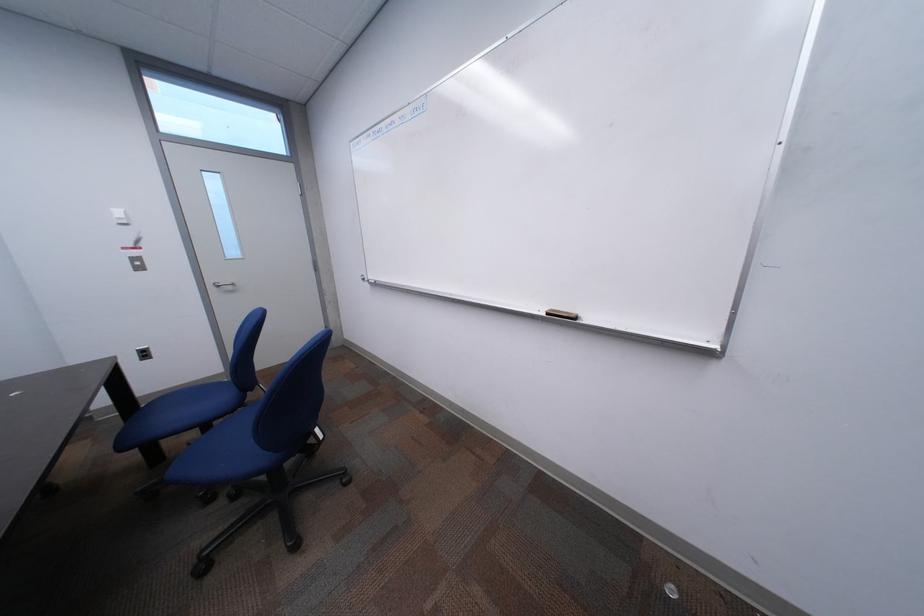
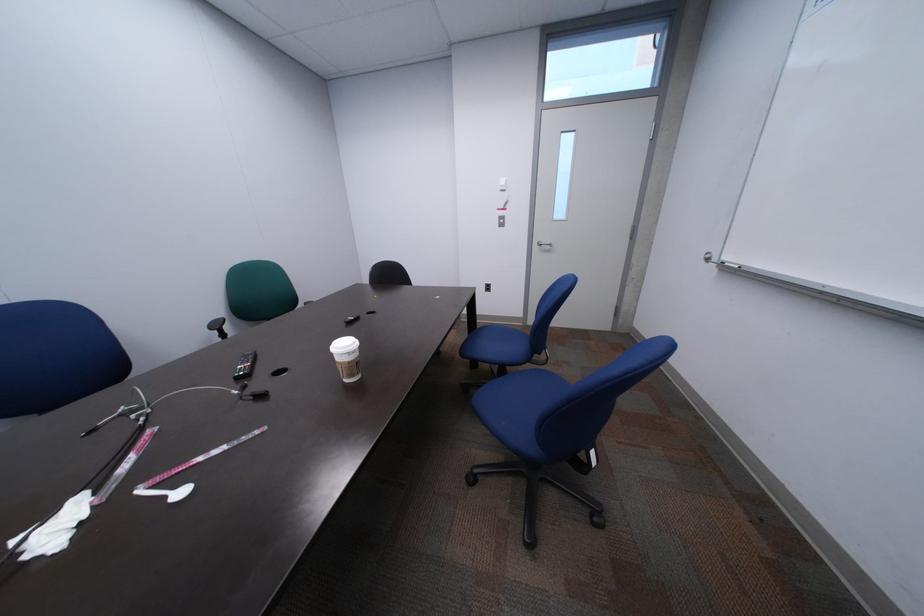
Question: The first image is from the beginning of the video and the second image is from the end. How did the camera likely rotate when shooting the video?

Choices:
 (A) Left
 (B) Right
 (C) Up
 (D) Down

Answer: (A)